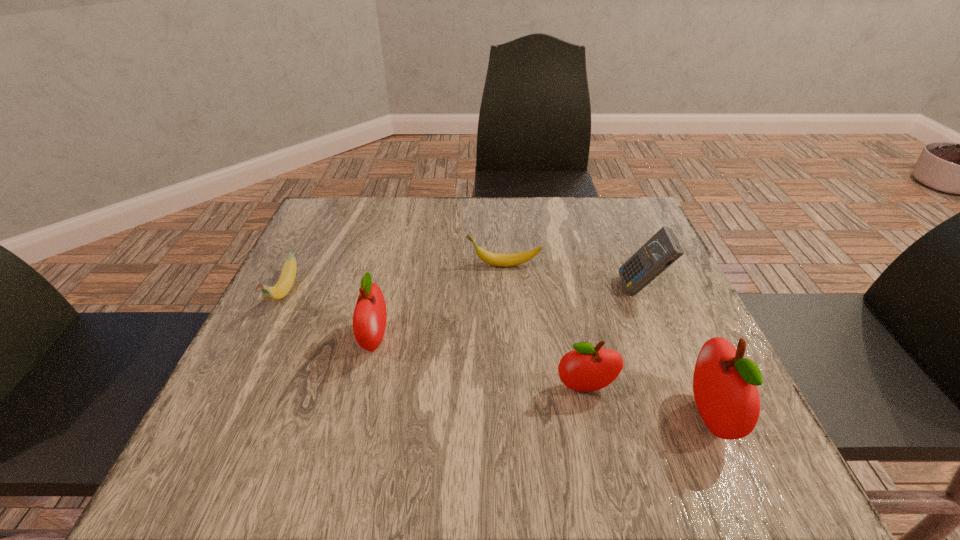
What are the coordinates of `the closest apple to the farthest apple` in the screenshot? It's located at (587, 368).

This screenshot has height=540, width=960. Find the location of `apple identified as the second closest to the fifth object from right to left`. apple identified as the second closest to the fifth object from right to left is located at coordinates pos(725,384).

Where is `vacant space that satisfies the following two spatial constraints: 1. at the stem of the right banana; 2. on the back side of the shortest apple`? The height and width of the screenshot is (540, 960). vacant space that satisfies the following two spatial constraints: 1. at the stem of the right banana; 2. on the back side of the shortest apple is located at coordinates (511, 388).

Locate an element on the screen. This screenshot has width=960, height=540. vacant space that satisfies the following two spatial constraints: 1. at the stem of the right banana; 2. at the stem of the leftmost object is located at coordinates (505, 293).

Find the location of a particular element. The image size is (960, 540). blank area in the image that satisfies the following two spatial constraints: 1. at the stem of the right banana; 2. on the right side of the rightmost apple is located at coordinates click(513, 416).

The image size is (960, 540). Identify the location of vacant area that satisfies the following two spatial constraints: 1. at the stem of the right banana; 2. on the right side of the fourth tallest object. (511, 388).

Find the location of `free location that satisfies the following two spatial constraints: 1. at the stem of the right banana; 2. at the stem of the leftmost object`. free location that satisfies the following two spatial constraints: 1. at the stem of the right banana; 2. at the stem of the leftmost object is located at coordinates (505, 293).

Image resolution: width=960 pixels, height=540 pixels. I want to click on free location that satisfies the following two spatial constraints: 1. at the stem of the left banana; 2. on the right side of the rightmost apple, so click(224, 416).

The height and width of the screenshot is (540, 960). What are the coordinates of `free space that satisfies the following two spatial constraints: 1. on the front-facing side of the calculator; 2. at the stem of the leftmost object` in the screenshot? It's located at (642, 293).